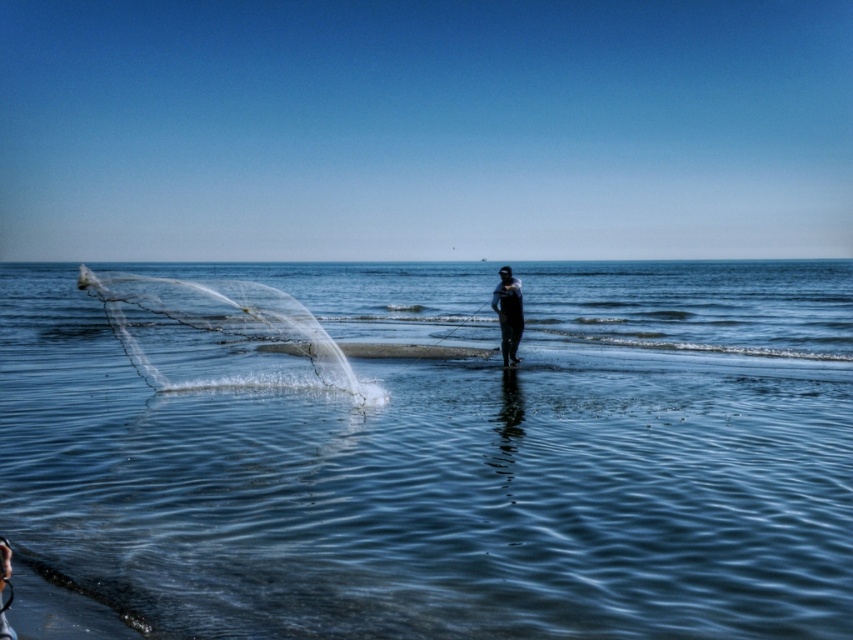
Can you confirm if transparent nylon net at left is smaller than black matte wetsuit at center?

No, transparent nylon net at left is not smaller than black matte wetsuit at center.

I want to click on transparent nylon net at left, so point(218,333).

Can you confirm if clear water at center is bigger than black matte wetsuit at center?

Yes.

Locate an element on the screen. The height and width of the screenshot is (640, 853). clear water at center is located at coordinates click(x=436, y=449).

You are a GUI agent. You are given a task and a screenshot of the screen. Output one action in this format:
    pyautogui.click(x=<x>, y=<y>)
    Task: Click on the clear water at center
    The width and height of the screenshot is (853, 640).
    Given the screenshot: What is the action you would take?
    pyautogui.click(x=436, y=449)

Does clear water at center come in front of transparent nylon net at left?

Yes, clear water at center is in front of transparent nylon net at left.

Which is in front, point (173, 426) or point (173, 387)?

Point (173, 426) is more forward.

At what (x,y) coordinates should I click in order to perform the action: click on clear water at center. Please return your answer as a coordinate pair (x, y). The height and width of the screenshot is (640, 853). Looking at the image, I should click on (436, 449).